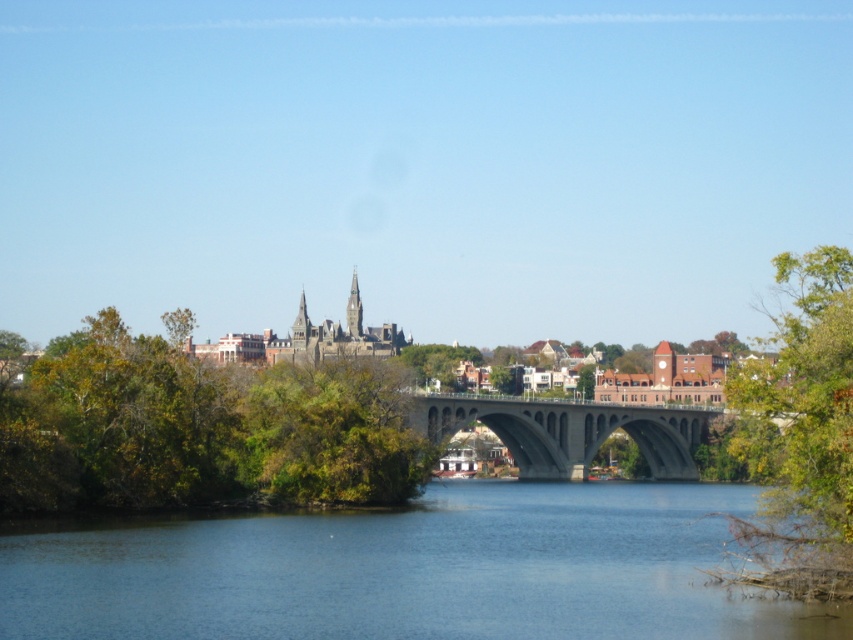
Is point (593, 502) positioned after point (758, 525)?

Yes, point (593, 502) is behind point (758, 525).

Between blue water at center and green leafy tree at right, which one is positioned higher?

green leafy tree at right

This screenshot has height=640, width=853. What do you see at coordinates (409, 570) in the screenshot? I see `blue water at center` at bounding box center [409, 570].

Image resolution: width=853 pixels, height=640 pixels. In order to click on blue water at center in this screenshot , I will do (409, 570).

You are a GUI agent. You are given a task and a screenshot of the screen. Output one action in this format:
    pyautogui.click(x=<x>, y=<y>)
    Task: Click on the green leafy trees at left
    
    Given the screenshot: What is the action you would take?
    pyautogui.click(x=199, y=428)

Is green leafy trees at left further to camera compared to concrete bridge at center?

No.

Measure the distance between green leafy trees at left and camera.

green leafy trees at left is 111.48 meters away from camera.

I want to click on green leafy trees at left, so click(199, 428).

Which is below, green leafy trees at left or gray stone spire at center?

green leafy trees at left

Which of these two, green leafy trees at left or gray stone spire at center, stands taller?

green leafy trees at left

Where is `green leafy trees at left`? The width and height of the screenshot is (853, 640). green leafy trees at left is located at coordinates (199, 428).

Find the location of a particular element. Image resolution: width=853 pixels, height=640 pixels. green leafy trees at left is located at coordinates (199, 428).